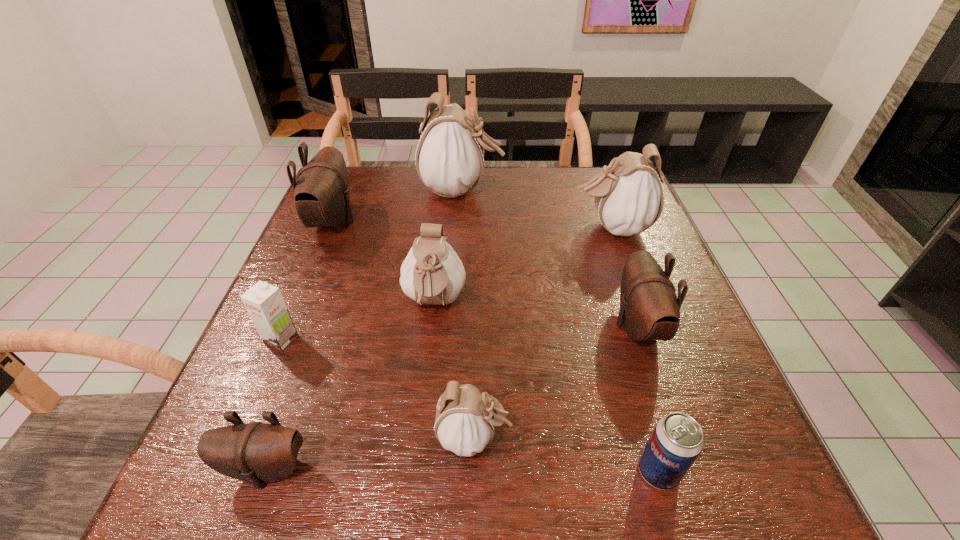
Where is `the smallest brown pouch`? Image resolution: width=960 pixels, height=540 pixels. the smallest brown pouch is located at coordinates (256, 452).

Where is `vacant space located 0.160m on the front-facing side of the tallest object`? The height and width of the screenshot is (540, 960). vacant space located 0.160m on the front-facing side of the tallest object is located at coordinates (558, 190).

Identify the location of vacant region located 0.100m on the front-facing side of the rightmost white pouch. The width and height of the screenshot is (960, 540). (535, 228).

You are a GUI agent. You are given a task and a screenshot of the screen. Output one action in this format:
    pyautogui.click(x=<x>, y=<y>)
    Task: Click on the free space located 0.340m on the front-facing side of the rightmost white pouch
    This screenshot has height=540, width=960.
    Given the screenshot: What is the action you would take?
    pyautogui.click(x=443, y=228)

Identify the location of free space located 0.200m on the front-facing side of the rightmost white pouch. This screenshot has height=540, width=960. (496, 228).

Where is `free point located 0.220m with the flap open on the farthest brown pouch`? free point located 0.220m with the flap open on the farthest brown pouch is located at coordinates (439, 222).

This screenshot has height=540, width=960. I want to click on vacant region located 0.190m on the front-facing side of the third biggest white pouch, so click(422, 418).

The image size is (960, 540). What are the coordinates of `free spot located 0.310m with the flap open on the second smallest brown pouch` in the screenshot? It's located at coord(464,326).

The width and height of the screenshot is (960, 540). Identify the location of vacant space located with the flap open on the second smallest brown pouch. (478, 326).

This screenshot has height=540, width=960. I want to click on vacant space located with the flap open on the second smallest brown pouch, so click(541, 326).